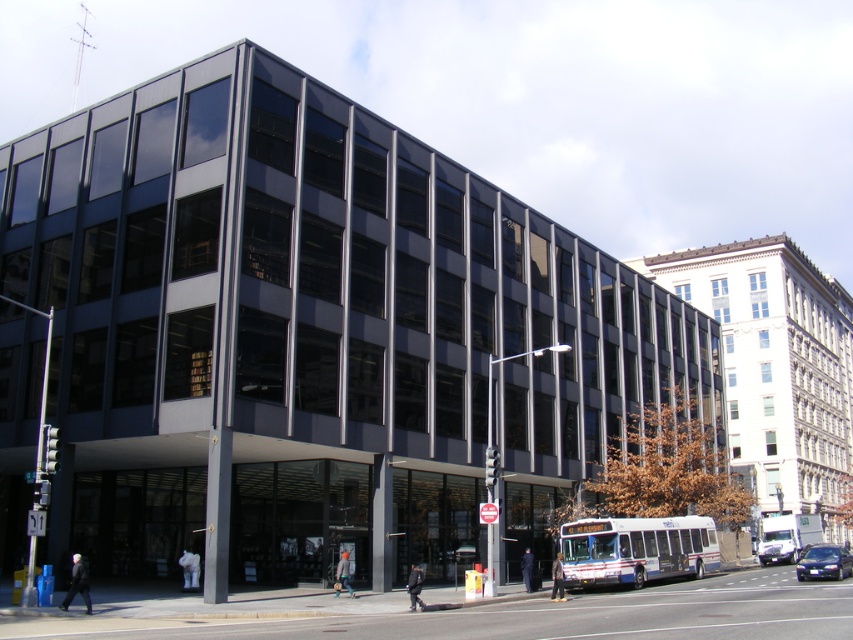
You are a delivery person needing to park your 5.5 meter long truck between the white metallic bus at center and the metallic blue sedan at center. Can you safely fit your truck in that space without overlapping either vehicle?

The distance between the white metallic bus at center and the metallic blue sedan at center is 6.45 meters. Since your truck is 5.5 meters long, it can fit in the space as there is enough room between them.

You are a delivery person trying to park your van next to the white metallic bus at center and the white matte bus at center. Which bus should you park next to if you need to leave enough space for your van, which is 2.5 meters wide?

The white metallic bus at center has a smaller width than the white matte bus at center. Since your van is 2.5 meters wide, you should park next to the white metallic bus at center to ensure there is enough space.

You are standing on the sidewalk in front of the modern multi story building and want to cross the street to reach the park on the other side. The white metallic bus at center is blocking your path. Can you walk around the front of the bus to get to the crosswalk?

The position of white metallic bus at center is at point (636, 548), which means it is parked near the curb. Since the bus is parked, you can walk around the front of the bus to reach the crosswalk.